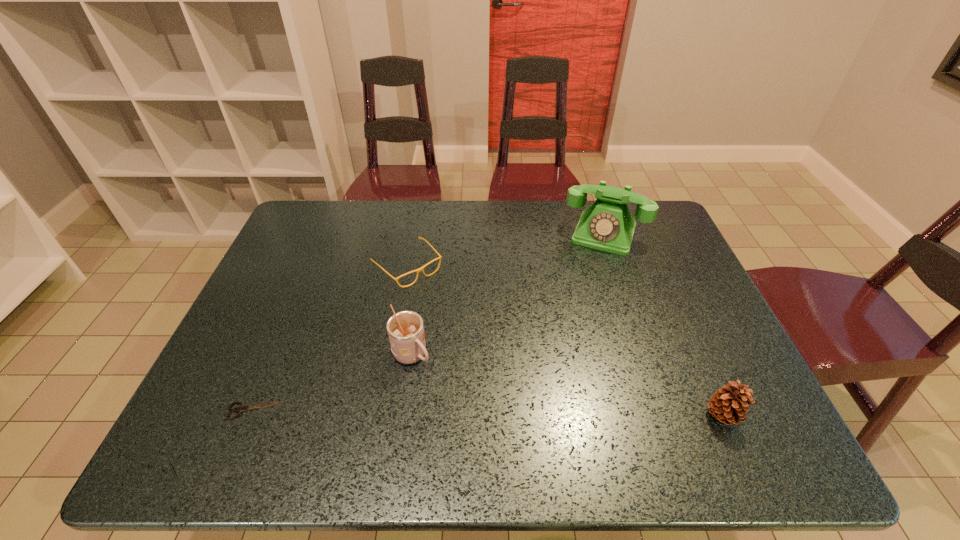
Find the location of a particular element. free space on the desktop that is between the leftmost object and the pinecone and is positioned on the side with the handle of the cup is located at coordinates (472, 413).

This screenshot has width=960, height=540. In order to click on free space on the desktop that is between the shears and the pinecone and is positioned on the dial of the tallest object in this screenshot , I will do `click(545, 414)`.

In order to click on vacant space on the desktop that is between the leftmost object and the pinecone and is positioned in front of the lenses of the spectacles in this screenshot , I will do `click(556, 414)`.